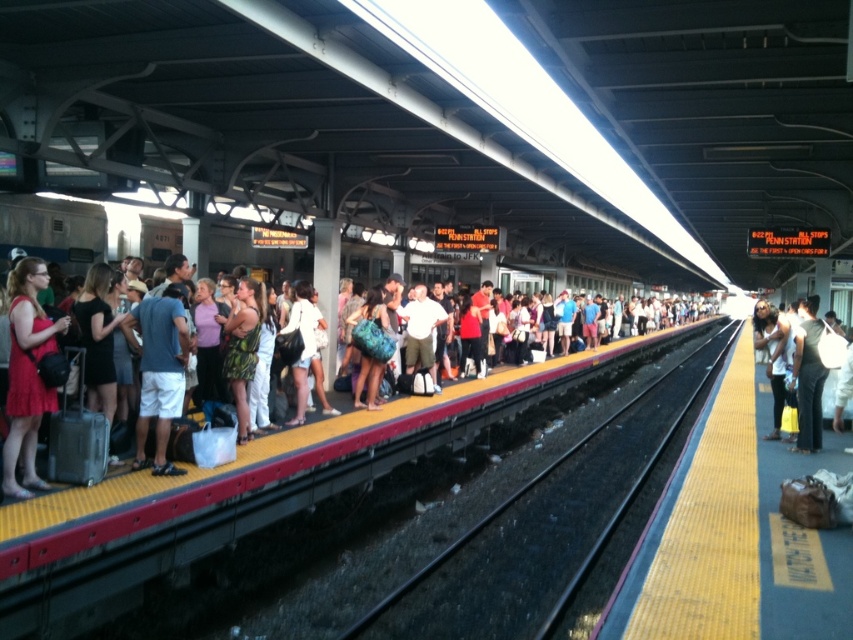
You are a luggage handler at the train station. You need to place the matte black bag at right onto the black asphalt train track at center. Can you do this without moving the bag more than 10 meters?

The distance between the matte black bag at right and the black asphalt train track at center is 9.63 meters, so yes, you can move the bag without exceeding 10 meters.

You are a commuter who just arrived at the train station and see the black asphalt train track at center and the matte black bag at right. Which object takes up more space in the scene?

The black asphalt train track at center takes up more space in the scene because it is larger in size than the matte black bag at right.